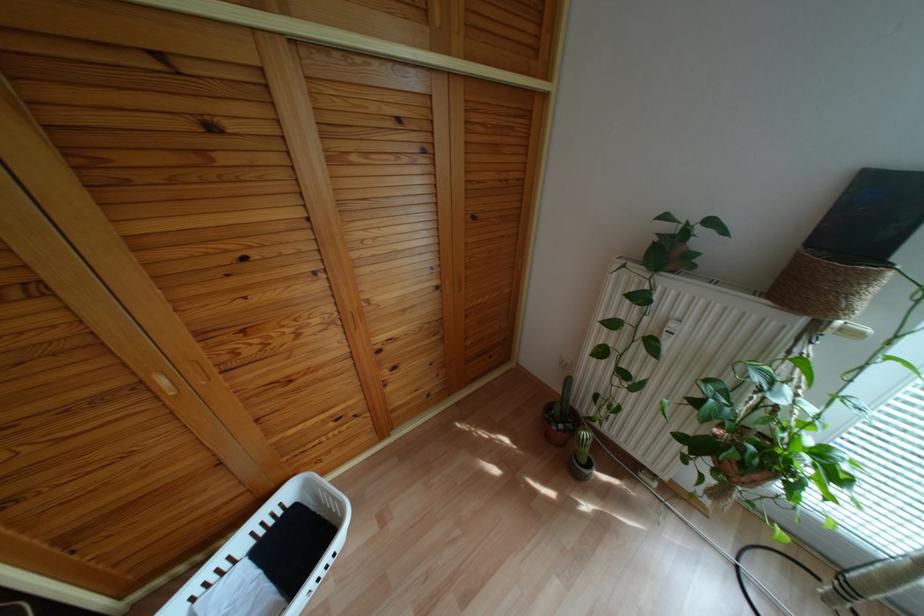
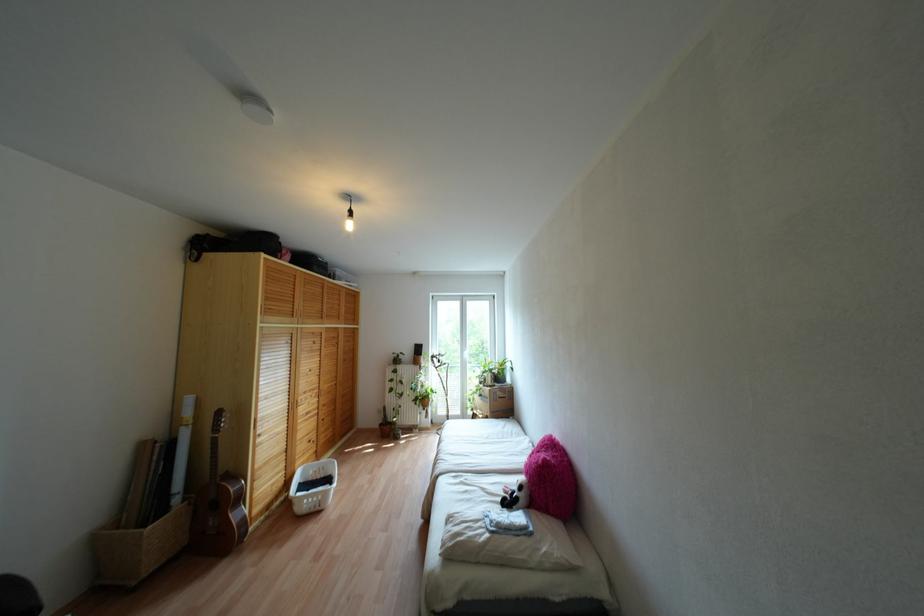
Find the pixel in the second image that matches the point at 821,453 in the first image.

(431, 389)